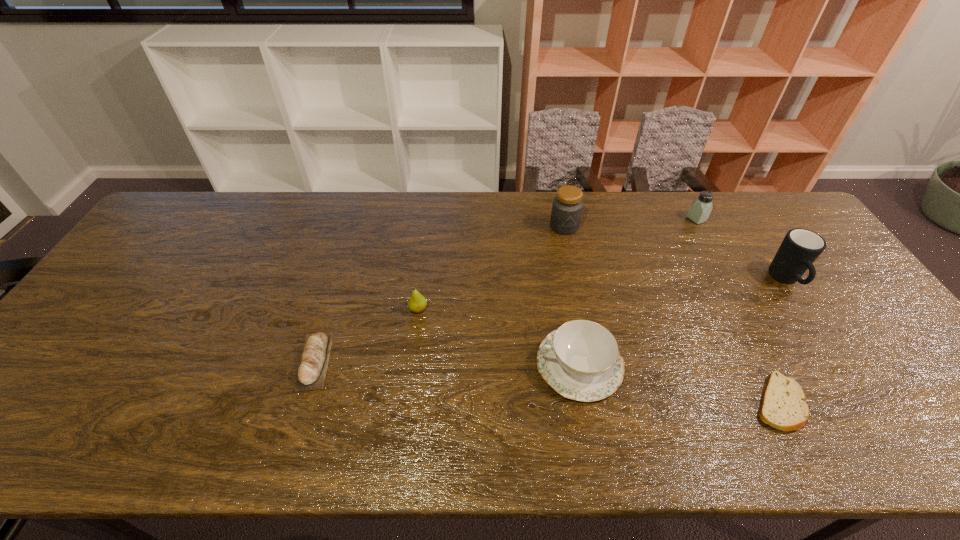
Where is `empty location between the chinaware and the taller pita bread`? empty location between the chinaware and the taller pita bread is located at coordinates (447, 363).

I want to click on empty space that is in between the right pita bread and the chinaware, so click(679, 383).

The width and height of the screenshot is (960, 540). I want to click on free space between the chinaware and the jar, so click(x=572, y=295).

The height and width of the screenshot is (540, 960). Identify the location of free spot between the saltshaker and the chinaware. (638, 292).

Locate an element on the screen. The width and height of the screenshot is (960, 540). vacant space that is in between the fifth nearest object and the saltshaker is located at coordinates (741, 249).

You are a GUI agent. You are given a task and a screenshot of the screen. Output one action in this format:
    pyautogui.click(x=<x>, y=<y>)
    Task: Click on the free spot between the jar and the chinaware
    The height and width of the screenshot is (540, 960).
    Given the screenshot: What is the action you would take?
    pyautogui.click(x=572, y=295)

This screenshot has width=960, height=540. In order to click on object that is the fifth nearest to the fifth nearest object in this screenshot , I will do `click(417, 303)`.

Locate which object ranks fourth in proximity to the left pita bread. Please provide its 2D coordinates. Your answer should be formatted as a tuple, i.e. [(x, y)], where the tuple contains the x and y coordinates of a point satisfying the conditions above.

[(783, 406)]

You are a GUI agent. You are given a task and a screenshot of the screen. Output one action in this format:
    pyautogui.click(x=<x>, y=<y>)
    Task: Click on the free spot that satisfies the following two spatial constraints: 1. on the surface of the jar near the warning symbol; 2. on the right side of the shorter pita bread
    This screenshot has width=960, height=540.
    Given the screenshot: What is the action you would take?
    pyautogui.click(x=601, y=402)